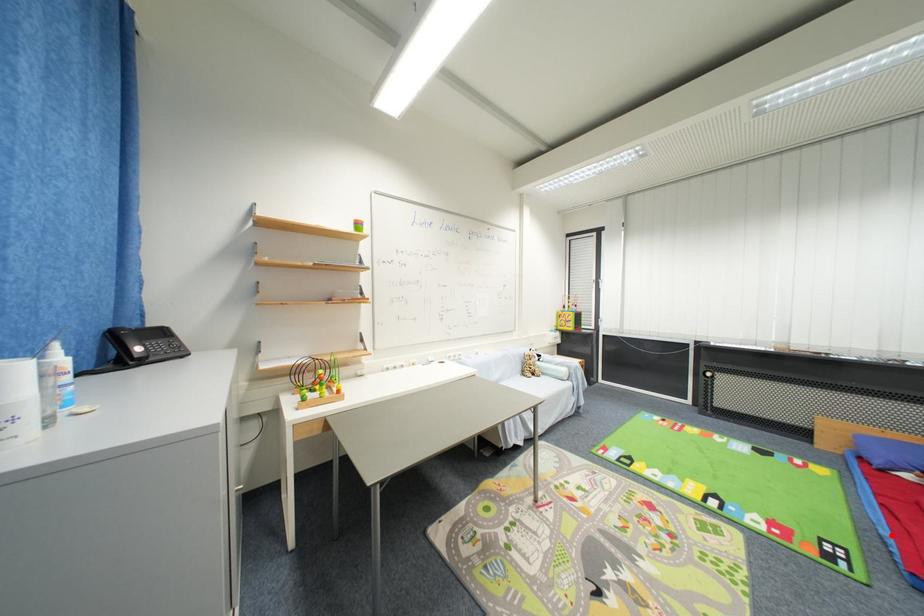
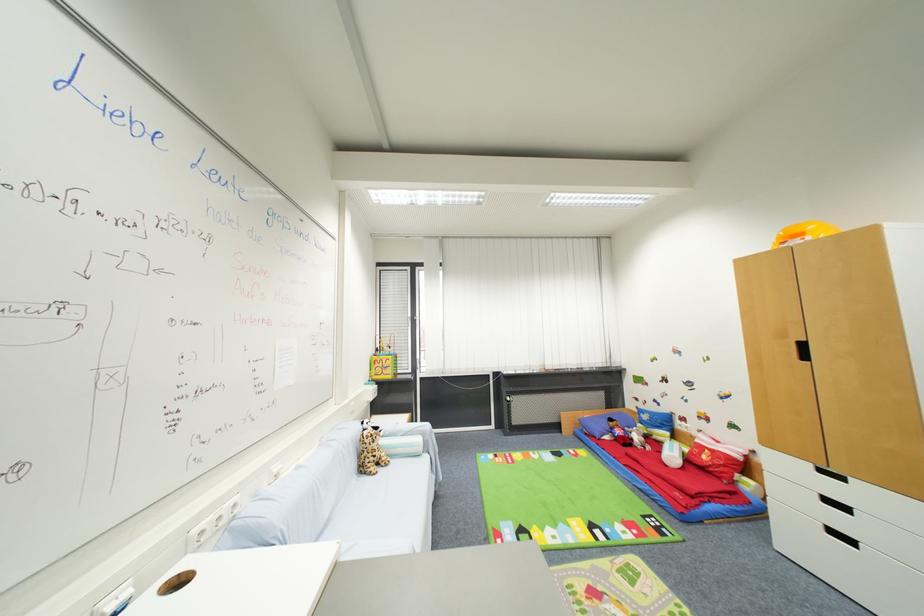
Question: I am providing you with two images of the same scene from different viewpoints. In image1, a red point is highlighted. Considering the same 3D point in image2, which of the following is correct?

Choices:
 (A) It is closer
 (B) It is farther

Answer: (A)